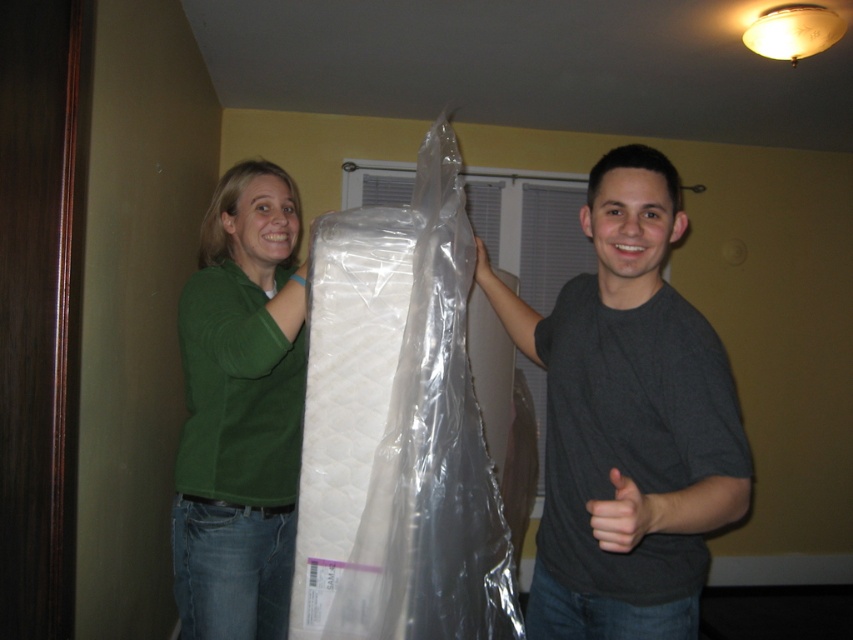
Between clear plastic mattress at center and green matte shirt at center, which one is positioned lower?

green matte shirt at center

Does point (294, 588) come in front of point (235, 387)?

Yes, point (294, 588) is closer to viewer.

The height and width of the screenshot is (640, 853). Identify the location of clear plastic mattress at center. (397, 428).

Can you confirm if clear plastic mattress at center is smaller than dark gray t-shirt at center?

Correct, clear plastic mattress at center occupies less space than dark gray t-shirt at center.

Is clear plastic mattress at center to the right of dark gray t-shirt at center from the viewer's perspective?

No, clear plastic mattress at center is not to the right of dark gray t-shirt at center.

Locate an element on the screen. This screenshot has height=640, width=853. clear plastic mattress at center is located at coordinates (397, 428).

Can you confirm if dark gray t-shirt at center is bigger than green matte shirt at center?

No, dark gray t-shirt at center is not bigger than green matte shirt at center.

Does dark gray t-shirt at center lie in front of green matte shirt at center?

Yes.

At what (x,y) coordinates should I click in order to perform the action: click on dark gray t-shirt at center. Please return your answer as a coordinate pair (x, y). The height and width of the screenshot is (640, 853). Looking at the image, I should click on (627, 420).